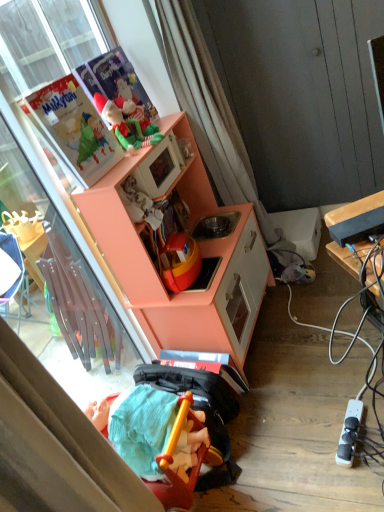
Identify the location of vacant area that lies to the right of white plastic power outlet at lower right. This screenshot has width=384, height=512. (369, 412).